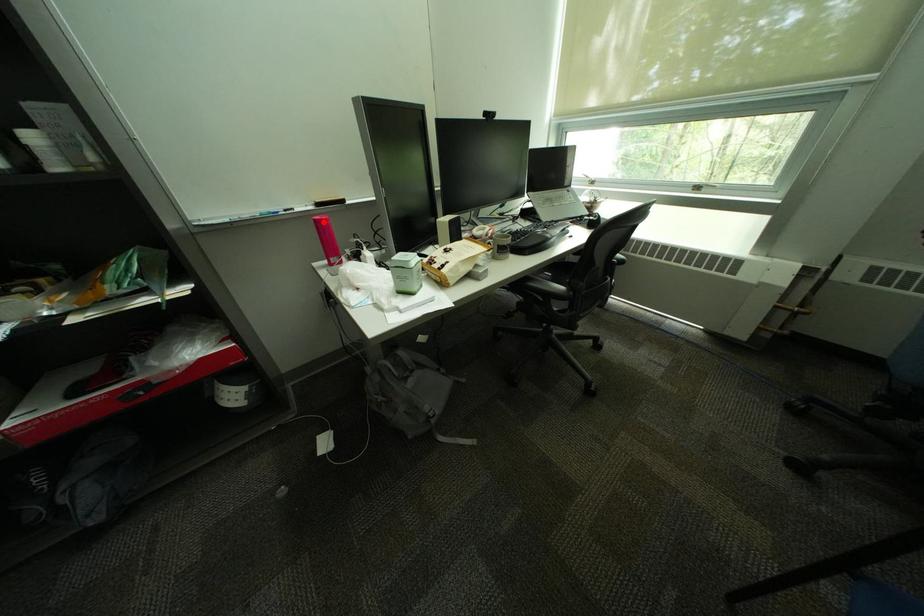
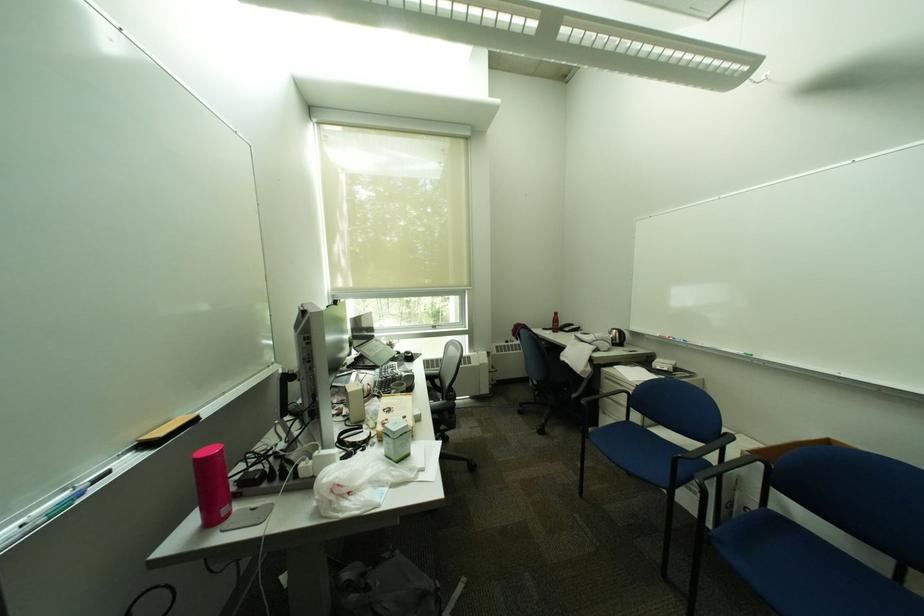
Question: I am providing you with two images of the same scene from different viewpoints. A red point is shown in image1. For the corresponding object point in image2, is it positioned nearer or farther from the camera?

Choices:
 (A) Nearer
 (B) Farther

Answer: (B)